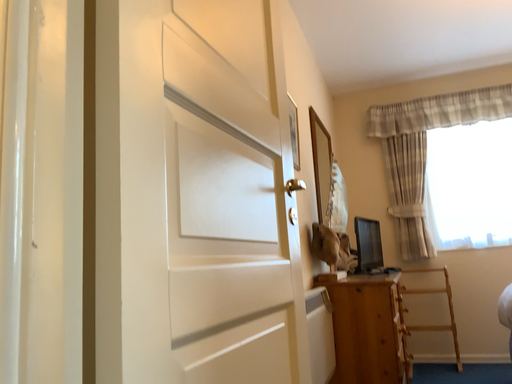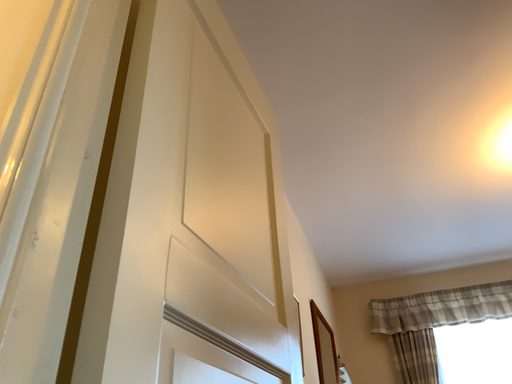
Question: How did the camera likely rotate when shooting the video?

Choices:
 (A) rotated upward
 (B) rotated downward

Answer: (A)